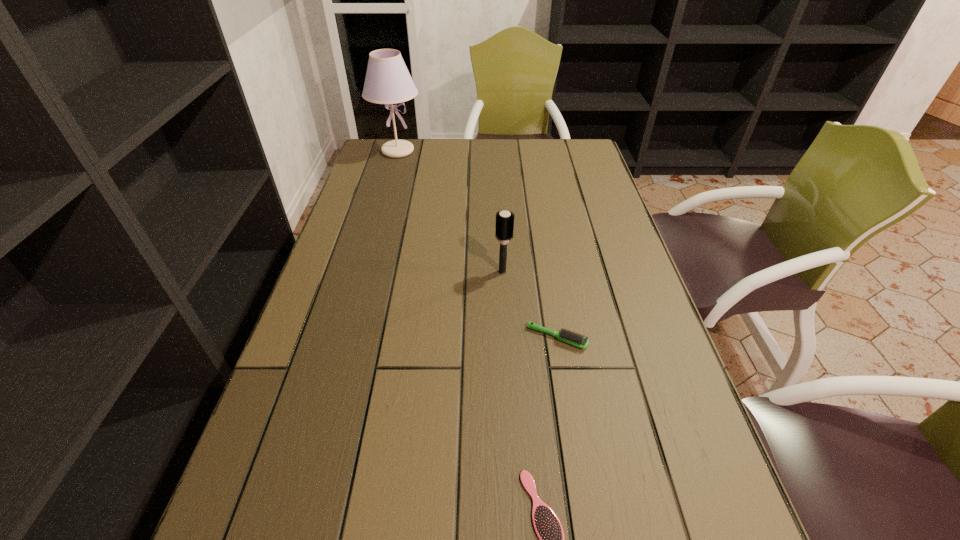
At what (x,y) coordinates should I click in order to perform the action: click on the leftmost object. Please return your answer as a coordinate pair (x, y). Looking at the image, I should click on coord(387,81).

Identify the location of the tallest object. This screenshot has width=960, height=540. (387, 81).

The width and height of the screenshot is (960, 540). I want to click on the third shortest object, so click(504, 220).

Identify the location of the farthest hairbrush. (504, 220).

This screenshot has width=960, height=540. I want to click on the second nearest object, so click(x=566, y=336).

This screenshot has width=960, height=540. I want to click on the second nearest hairbrush, so click(x=566, y=336).

This screenshot has width=960, height=540. Identify the location of free location located 0.140m on the right of the leftmost object. (463, 151).

Identify the location of free space located on the right of the third nearest object. (543, 272).

Find the location of a particular element. This screenshot has height=540, width=960. vacant space located 0.130m on the back of the second nearest hairbrush is located at coordinates (548, 284).

Where is `object located at the far edge`? The width and height of the screenshot is (960, 540). object located at the far edge is located at coordinates (387, 81).